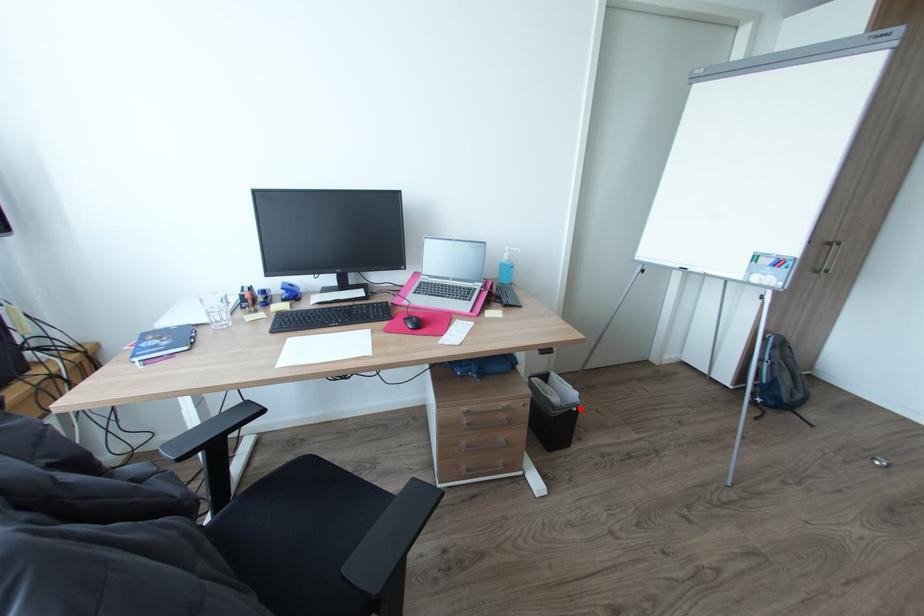
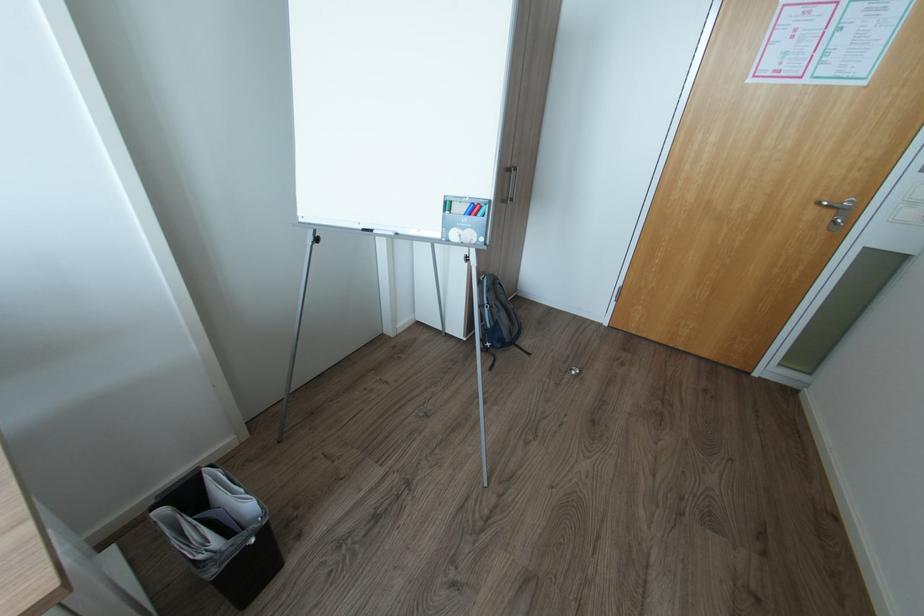
Question: I am providing you with two images of the same scene from different viewpoints. A red point is marked on the first image. Is the red point's position out of view in image 2?

Choices:
 (A) Yes
 (B) No

Answer: (B)